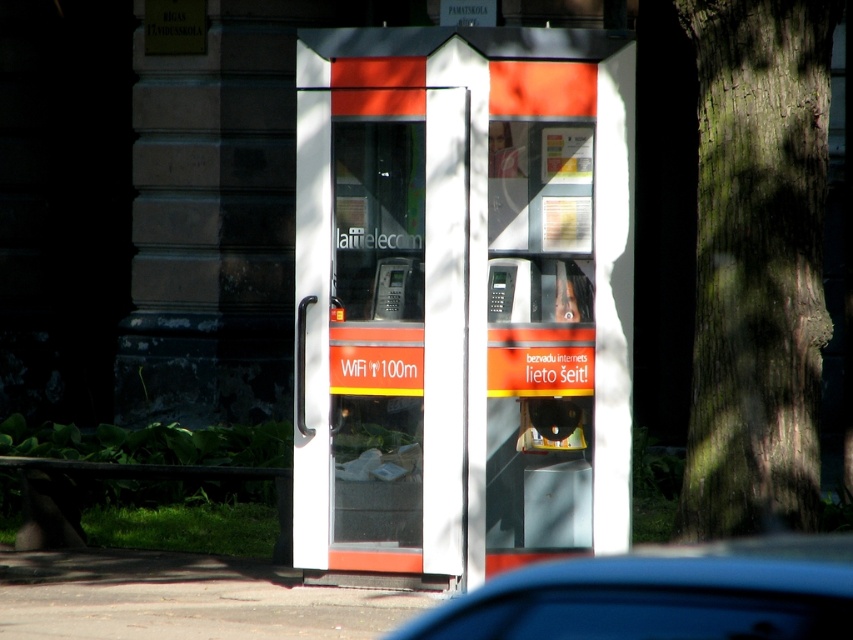
Question: Does blue glossy car at lower center have a larger size compared to matte plastic payphone at center?

Choices:
 (A) no
 (B) yes

Answer: (B)

Question: Based on their relative distances, which object is farther from the green rough bark tree at right?

Choices:
 (A) matte plastic payphone at center
 (B) orange glossy phone booth at center
 (C) blue glossy car at lower center

Answer: (C)

Question: Is orange glossy phone booth at center in front of green rough bark tree at right?

Choices:
 (A) yes
 (B) no

Answer: (B)

Question: Which is nearer to the blue glossy car at lower center?

Choices:
 (A) green rough bark tree at right
 (B) matte plastic payphone at center
 (C) orange glossy phone booth at center

Answer: (A)

Question: Is green rough bark tree at right positioned behind blue glossy car at lower center?

Choices:
 (A) yes
 (B) no

Answer: (A)

Question: Which point is closer to the camera?

Choices:
 (A) green rough bark tree at right
 (B) orange glossy phone booth at center

Answer: (A)